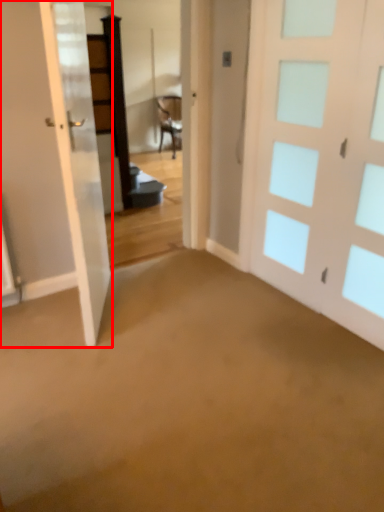
Question: From the image's perspective, where is door (annotated by the red box) located in relation to door in the image?

Choices:
 (A) above
 (B) below

Answer: (B)